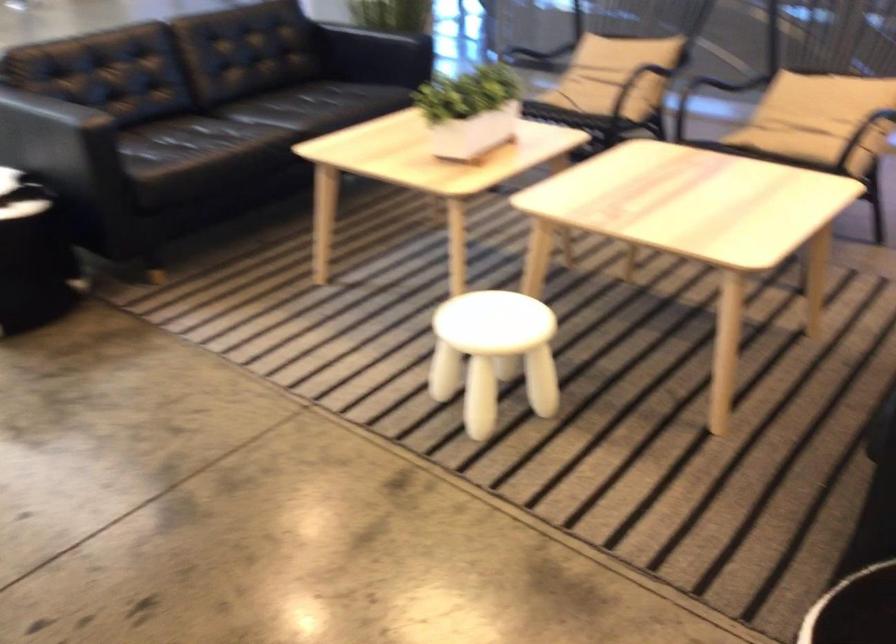
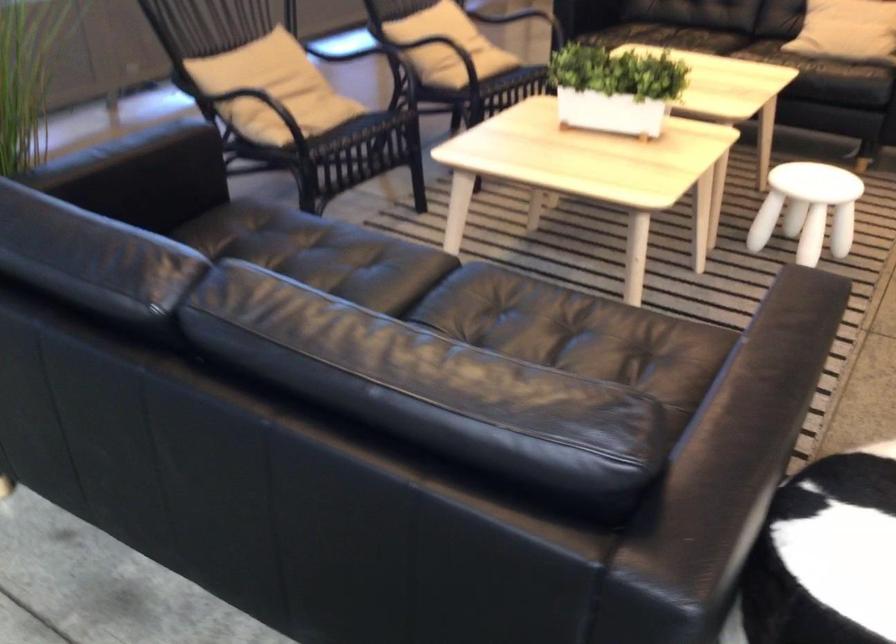
The point at [474,337] is marked in the first image. Where is the corresponding point in the second image?

(807, 209)